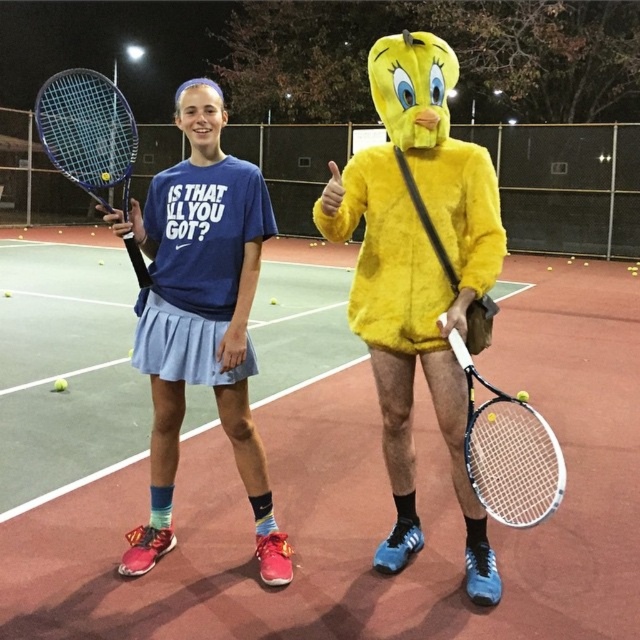
You are a tennis coach observing a practice session on the tennis court. You notice the green synthetic turf at center and the white matte tennis racket at center. Which object is taller?

The white matte tennis racket at center is taller than the green synthetic turf at center.